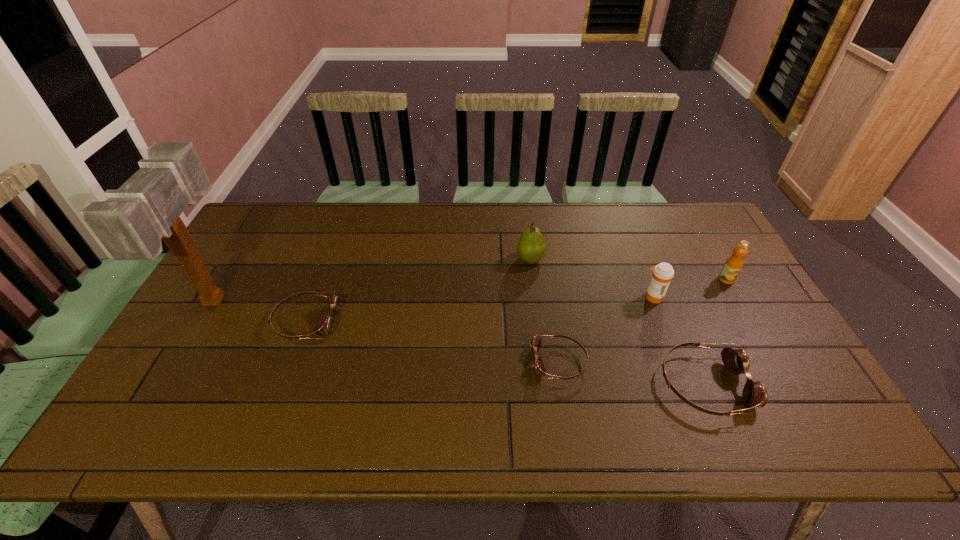
Identify the location of the second closest object to the orange juice. (736, 361).

Select which goggles is the third closest to the leftmost object. Please provide its 2D coordinates. Your answer should be formatted as a tuple, i.e. [(x, y)], where the tuple contains the x and y coordinates of a point satisfying the conditions above.

[(736, 361)]

Locate which goggles ranks in proximity to the orange juice. Please provide its 2D coordinates. Your answer should be formatted as a tuple, i.e. [(x, y)], where the tuple contains the x and y coordinates of a point satisfying the conditions above.

[(736, 361)]

In order to click on vacant space that satisfies the following two spatial constraints: 1. on the front label of the orange juice; 2. through the lenses of the second object from left to right in this screenshot , I will do `click(750, 321)`.